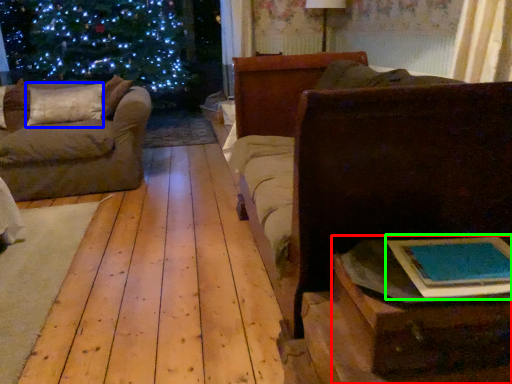
Question: Which object is positioned closest to table (highlighted by a red box)? Select from pillow (highlighted by a blue box) and book (highlighted by a green box).

Choices:
 (A) pillow
 (B) book

Answer: (B)